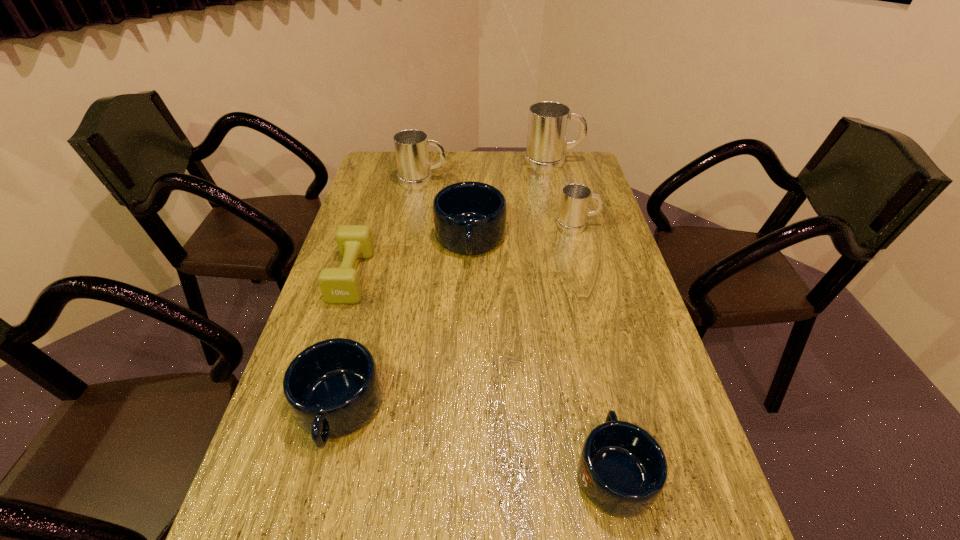
Identify the location of free area in between the second smallest blue mug and the second blue mug from left to right. (404, 325).

You are a GUI agent. You are given a task and a screenshot of the screen. Output one action in this format:
    pyautogui.click(x=<x>, y=<y>)
    Task: Click on the unoccupied area between the olive dumbbell and the biggest blue mug
    The height and width of the screenshot is (540, 960).
    Given the screenshot: What is the action you would take?
    pyautogui.click(x=411, y=258)

Locate an element on the screen. The height and width of the screenshot is (540, 960). free space between the second biggest blue mug and the tallest object is located at coordinates (445, 286).

Where is `object that is the fourth closest to the leftmost blue mug`? The height and width of the screenshot is (540, 960). object that is the fourth closest to the leftmost blue mug is located at coordinates (575, 199).

The image size is (960, 540). Identify the location of object that stands as the fifth closest to the rightmost blue mug. point(411,146).

Locate which mug ranks third in proximity to the tallest mug. Please provide its 2D coordinates. Your answer should be formatted as a tuple, i.e. [(x, y)], where the tuple contains the x and y coordinates of a point satisfying the conditions above.

[(411, 146)]

Point out which mug is positioned as the fifth nearest to the second blue mug from right to left. Please provide its 2D coordinates. Your answer should be formatted as a tuple, i.e. [(x, y)], where the tuple contains the x and y coordinates of a point satisfying the conditions above.

[(622, 469)]

Identify which gray mug is located as the nearest to the olive dumbbell. Please provide its 2D coordinates. Your answer should be formatted as a tuple, i.e. [(x, y)], where the tuple contains the x and y coordinates of a point satisfying the conditions above.

[(411, 146)]

Identify which gray mug is located as the second nearest to the leftmost gray mug. Please provide its 2D coordinates. Your answer should be formatted as a tuple, i.e. [(x, y)], where the tuple contains the x and y coordinates of a point satisfying the conditions above.

[(575, 199)]

Identify which blue mug is the closest to the farthest blue mug. Please provide its 2D coordinates. Your answer should be formatted as a tuple, i.e. [(x, y)], where the tuple contains the x and y coordinates of a point satisfying the conditions above.

[(333, 388)]